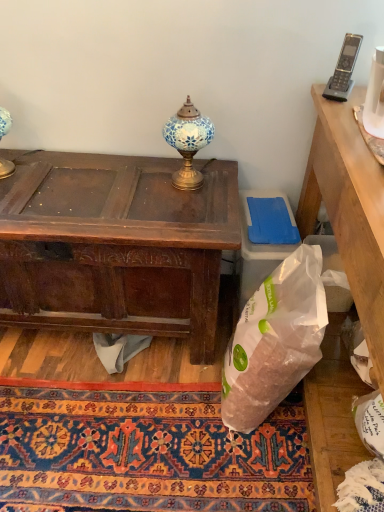
Locate an element on the screen. free space in front of dark brown wood desk at center is located at coordinates (109, 428).